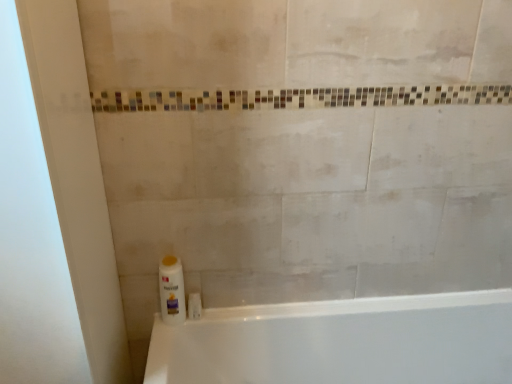
Question: Choose the correct answer: Is white glossy bathtub at lower left inside white glossy screen door at left or outside it?

Choices:
 (A) outside
 (B) inside

Answer: (A)

Question: From the image's perspective, is white glossy bathtub at lower left above or below white glossy screen door at left?

Choices:
 (A) below
 (B) above

Answer: (A)

Question: Which object is the closest to the white glossy bottle at lower left?

Choices:
 (A) white glossy screen door at left
 (B) white glossy bathtub at lower left

Answer: (A)

Question: Which is nearer to the white glossy screen door at left?

Choices:
 (A) white glossy bottle at lower left
 (B) white glossy bathtub at lower left

Answer: (A)